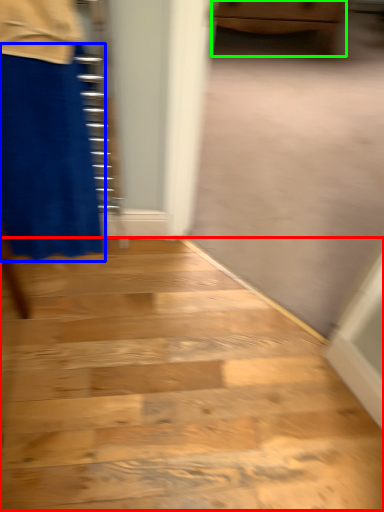
Question: Estimate the real-world distances between objects in this image. Which object is farther from stairwell (highlighted by a red box), miniskirt (highlighted by a blue box) or furniture (highlighted by a green box)?

Choices:
 (A) miniskirt
 (B) furniture

Answer: (B)